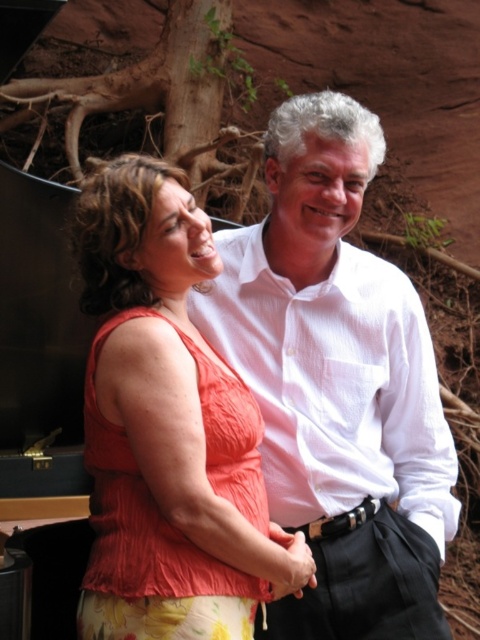
Question: Is orange fabric top at center positioned behind white textured shirt at center?

Choices:
 (A) yes
 (B) no

Answer: (B)

Question: Is orange fabric top at center closer to the viewer compared to white textured shirt at center?

Choices:
 (A) yes
 (B) no

Answer: (A)

Question: Is orange fabric top at center in front of white textured shirt at center?

Choices:
 (A) no
 (B) yes

Answer: (B)